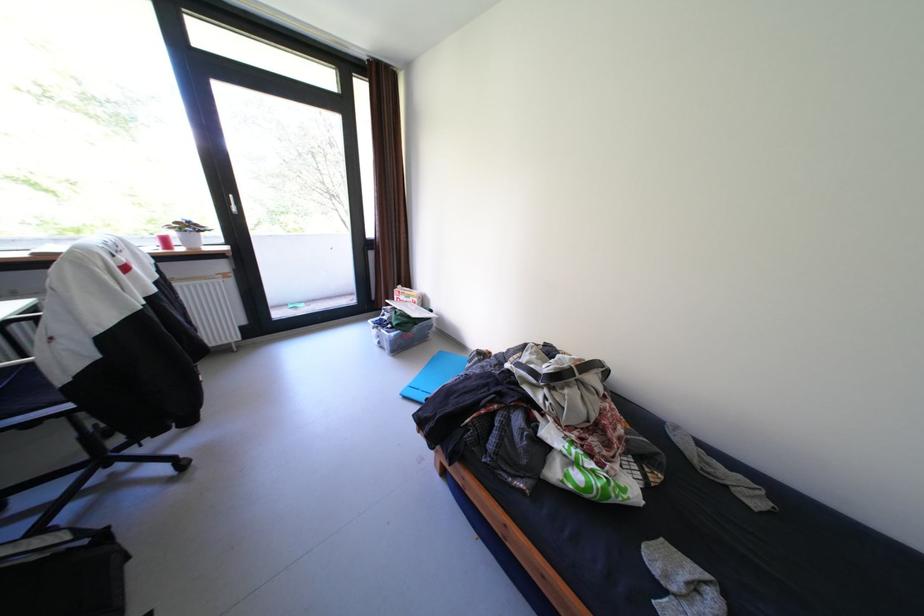
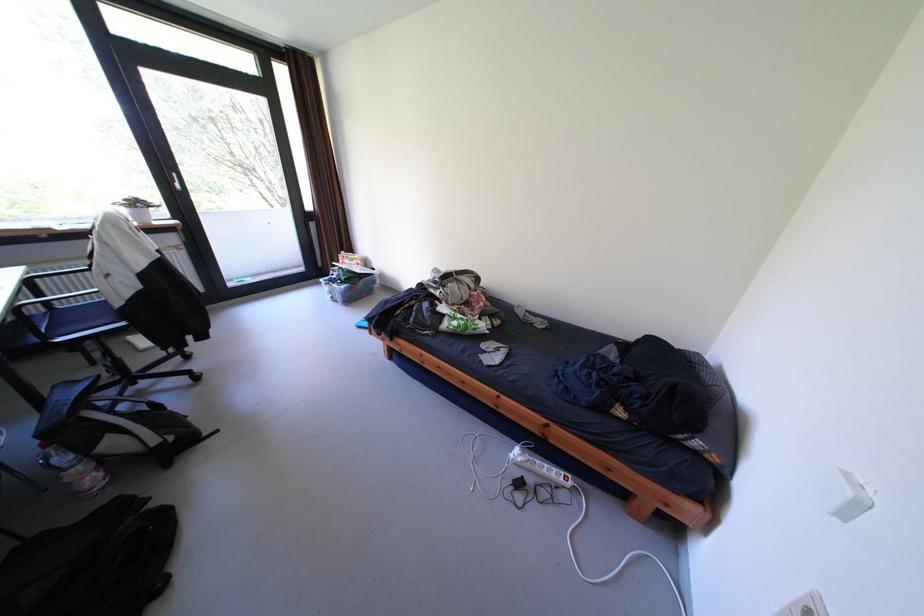
Where in the second image is the point corresponding to [631,431] from the first image?

(492, 304)